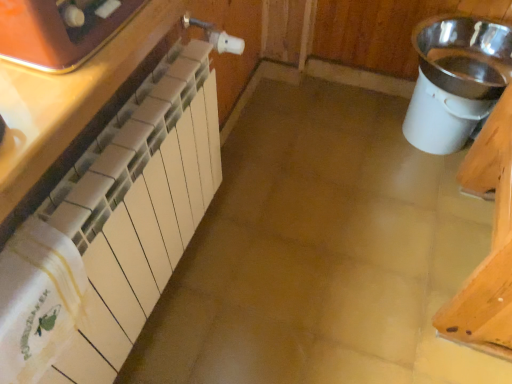
What do you see at coordinates (108, 211) in the screenshot? The image size is (512, 384). I see `matte white radiator at left, the second cabinetry positioned from the front` at bounding box center [108, 211].

You are a GUI agent. You are given a task and a screenshot of the screen. Output one action in this format:
    pyautogui.click(x=<x>, y=<y>)
    Task: Click on the matte orange toaster at upper left
    Image resolution: width=512 pixels, height=384 pixels.
    Given the screenshot: What is the action you would take?
    pyautogui.click(x=60, y=30)

The image size is (512, 384). Describe the element at coordinates (60, 30) in the screenshot. I see `matte orange toaster at upper left` at that location.

Identify the location of white glossy radiator at left, which appears as the first cabinetry when viewed from the front. Image resolution: width=512 pixels, height=384 pixels. (81, 110).

This screenshot has width=512, height=384. I want to click on silver metallic sink at right, so click(456, 80).

Based on the photo, how many degrees apart are the facing directions of matte white radiator at left, the second cabinetry positioned from the front, and matte orange toaster at upper left?

The angle between the facing direction of matte white radiator at left, the second cabinetry positioned from the front, and the facing direction of matte orange toaster at upper left is 1.25 degrees.

From a real-world perspective, is matte white radiator at left, the 1th cabinetry from the back, located beneath matte orange toaster at upper left?

Yes, from a real-world perspective, matte white radiator at left, the 1th cabinetry from the back, is below matte orange toaster at upper left.

Does matte white radiator at left, the second cabinetry positioned from the front, appear on the left side of matte orange toaster at upper left?

No.

Locate an element on the screen. Image resolution: width=512 pixels, height=384 pixels. the 2nd cabinetry below the matte orange toaster at upper left (from the image's perspective) is located at coordinates (108, 211).

Is silver metallic sink at right completely or partially outside of matte white radiator at left, the second cabinetry positioned from the front?

Yes, silver metallic sink at right is outside of matte white radiator at left, the second cabinetry positioned from the front.

Find the location of a particular element. sink behind the matte white radiator at left, the second cabinetry positioned from the front is located at coordinates (456, 80).

From the image's perspective, is silver metallic sink at right on top of matte white radiator at left, the second cabinetry positioned from the front?

Yes, from the image's perspective, silver metallic sink at right is above matte white radiator at left, the second cabinetry positioned from the front.

Is silver metallic sink at right placed right next to matte white radiator at left, the 1th cabinetry from the back?

silver metallic sink at right and matte white radiator at left, the 1th cabinetry from the back, are not in contact.

Is white glossy radiator at left, the 2th cabinetry in the back-to-front sequence, located outside matte orange toaster at upper left?

Yes, white glossy radiator at left, the 2th cabinetry in the back-to-front sequence, is not within matte orange toaster at upper left.

Is white glossy radiator at left, the 2th cabinetry in the back-to-front sequence, positioned with its back to matte orange toaster at upper left?

No, white glossy radiator at left, the 2th cabinetry in the back-to-front sequence, is not facing the opposite direction of matte orange toaster at upper left.

Is the depth of white glossy radiator at left, which appears as the first cabinetry when viewed from the front, greater than that of matte orange toaster at upper left?

No, it is in front of matte orange toaster at upper left.

Considering the positions of objects white glossy radiator at left, the 2th cabinetry in the back-to-front sequence, and matte orange toaster at upper left in the image provided, who is more to the left, white glossy radiator at left, the 2th cabinetry in the back-to-front sequence, or matte orange toaster at upper left?

white glossy radiator at left, the 2th cabinetry in the back-to-front sequence.

Considering the relative sizes of white glossy radiator at left, the 2th cabinetry in the back-to-front sequence, and silver metallic sink at right in the image provided, is white glossy radiator at left, the 2th cabinetry in the back-to-front sequence, shorter than silver metallic sink at right?

Correct, white glossy radiator at left, the 2th cabinetry in the back-to-front sequence, is not as tall as silver metallic sink at right.

Between white glossy radiator at left, which appears as the first cabinetry when viewed from the front, and silver metallic sink at right, which one has smaller width?

white glossy radiator at left, which appears as the first cabinetry when viewed from the front, is thinner.

How many degrees apart are the facing directions of white glossy radiator at left, which appears as the first cabinetry when viewed from the front, and silver metallic sink at right?

84.7 degrees separate the facing orientations of white glossy radiator at left, which appears as the first cabinetry when viewed from the front, and silver metallic sink at right.

Is white glossy radiator at left, which appears as the first cabinetry when viewed from the front, situated inside silver metallic sink at right or outside?

white glossy radiator at left, which appears as the first cabinetry when viewed from the front, cannot be found inside silver metallic sink at right.

Is matte orange toaster at upper left located outside white glossy radiator at left, the 2th cabinetry in the back-to-front sequence?

Yes, matte orange toaster at upper left is located beyond the bounds of white glossy radiator at left, the 2th cabinetry in the back-to-front sequence.

Is matte orange toaster at upper left facing towards white glossy radiator at left, the 2th cabinetry in the back-to-front sequence?

No.

Are matte orange toaster at upper left and white glossy radiator at left, which appears as the first cabinetry when viewed from the front, beside each other?

matte orange toaster at upper left and white glossy radiator at left, which appears as the first cabinetry when viewed from the front, are clearly separated.

Considering the relative sizes of matte orange toaster at upper left and white glossy radiator at left, which appears as the first cabinetry when viewed from the front, in the image provided, is matte orange toaster at upper left shorter than white glossy radiator at left, which appears as the first cabinetry when viewed from the front,?

Incorrect, the height of matte orange toaster at upper left does not fall short of that of white glossy radiator at left, which appears as the first cabinetry when viewed from the front.

Is white glossy radiator at left, the 2th cabinetry in the back-to-front sequence, taller or shorter than matte white radiator at left, the second cabinetry positioned from the front?

white glossy radiator at left, the 2th cabinetry in the back-to-front sequence, is shorter than matte white radiator at left, the second cabinetry positioned from the front.

You are a GUI agent. You are given a task and a screenshot of the screen. Output one action in this format:
    pyautogui.click(x=<x>, y=<y>)
    Task: Click on the cabinetry above the matte white radiator at left, the 1th cabinetry from the back (from a real-world perspective)
    The image size is (512, 384).
    Given the screenshot: What is the action you would take?
    pyautogui.click(x=81, y=110)

Relative to matte white radiator at left, the second cabinetry positioned from the front, is white glossy radiator at left, the 2th cabinetry in the back-to-front sequence, in front or behind?

Clearly, white glossy radiator at left, the 2th cabinetry in the back-to-front sequence, is in front of matte white radiator at left, the second cabinetry positioned from the front.

Is matte orange toaster at upper left aimed at silver metallic sink at right?

No, matte orange toaster at upper left is not oriented towards silver metallic sink at right.

Visually, is matte orange toaster at upper left positioned to the left or to the right of silver metallic sink at right?

In the image, matte orange toaster at upper left appears on the left side of silver metallic sink at right.

From the image's perspective, who appears lower, matte orange toaster at upper left or silver metallic sink at right?

matte orange toaster at upper left.

Who is smaller, matte orange toaster at upper left or silver metallic sink at right?

With smaller size is matte orange toaster at upper left.

Where is `cabinetry that is the 2nd one below the matte orange toaster at upper left (from a real-world perspective)`? This screenshot has width=512, height=384. cabinetry that is the 2nd one below the matte orange toaster at upper left (from a real-world perspective) is located at coordinates (108, 211).

Where is `the 2nd cabinetry below when counting from the silver metallic sink at right (from the image's perspective)`? the 2nd cabinetry below when counting from the silver metallic sink at right (from the image's perspective) is located at coordinates (108, 211).

In the scene shown: From the image, which object appears to be nearer to silver metallic sink at right, matte white radiator at left, the 1th cabinetry from the back, or matte orange toaster at upper left?

Among the two, matte white radiator at left, the 1th cabinetry from the back, is located nearer to silver metallic sink at right.

When comparing their distances from silver metallic sink at right, does matte orange toaster at upper left or white glossy radiator at left, the 2th cabinetry in the back-to-front sequence, seem further?

matte orange toaster at upper left lies further to silver metallic sink at right than the other object.

Estimate the real-world distances between objects in this image. Which object is closer to matte white radiator at left, the 1th cabinetry from the back, white glossy radiator at left, which appears as the first cabinetry when viewed from the front, or silver metallic sink at right?

white glossy radiator at left, which appears as the first cabinetry when viewed from the front, is positioned closer to the anchor matte white radiator at left, the 1th cabinetry from the back.

Based on their spatial positions, is silver metallic sink at right or white glossy radiator at left, the 2th cabinetry in the back-to-front sequence, closer to matte orange toaster at upper left?

white glossy radiator at left, the 2th cabinetry in the back-to-front sequence, is positioned closer to the anchor matte orange toaster at upper left.

Based on their spatial positions, is silver metallic sink at right or matte white radiator at left, the 1th cabinetry from the back, closer to white glossy radiator at left, which appears as the first cabinetry when viewed from the front?

matte white radiator at left, the 1th cabinetry from the back, lies closer to white glossy radiator at left, which appears as the first cabinetry when viewed from the front, than the other object.

Which object lies further to the anchor point matte orange toaster at upper left, white glossy radiator at left, which appears as the first cabinetry when viewed from the front, or matte white radiator at left, the 1th cabinetry from the back?

Among the two, matte white radiator at left, the 1th cabinetry from the back, is located further to matte orange toaster at upper left.

From the image, which object appears to be nearer to matte white radiator at left, the second cabinetry positioned from the front, silver metallic sink at right or white glossy radiator at left, which appears as the first cabinetry when viewed from the front?

white glossy radiator at left, which appears as the first cabinetry when viewed from the front.

Looking at the image, which one is located further to white glossy radiator at left, which appears as the first cabinetry when viewed from the front, matte white radiator at left, the 1th cabinetry from the back, or matte orange toaster at upper left?

matte white radiator at left, the 1th cabinetry from the back.

You are a GUI agent. You are given a task and a screenshot of the screen. Output one action in this format:
    pyautogui.click(x=<x>, y=<y>)
    Task: Click on the cabinetry between matte orange toaster at upper left and matte white radiator at left, the second cabinetry positioned from the front, from top to bottom
    The width and height of the screenshot is (512, 384).
    Given the screenshot: What is the action you would take?
    pyautogui.click(x=81, y=110)

You are a GUI agent. You are given a task and a screenshot of the screen. Output one action in this format:
    pyautogui.click(x=<x>, y=<y>)
    Task: Click on the cabinetry situated between white glossy radiator at left, which appears as the first cabinetry when viewed from the front, and silver metallic sink at right from left to right
    The image size is (512, 384).
    Given the screenshot: What is the action you would take?
    [108, 211]

Find the location of a particular element. The height and width of the screenshot is (384, 512). cabinetry between matte orange toaster at upper left and silver metallic sink at right from left to right is located at coordinates (108, 211).

At what (x,y) coordinates should I click in order to perform the action: click on home appliance located between white glossy radiator at left, which appears as the first cabinetry when viewed from the front, and silver metallic sink at right in the left-right direction. Please return your answer as a coordinate pair (x, y). This screenshot has width=512, height=384. Looking at the image, I should click on (60, 30).